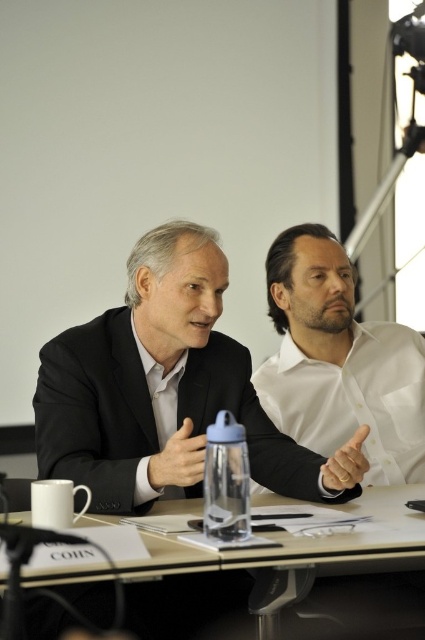
Question: Does white glossy shirt at center have a greater width compared to clear glass water at center?

Choices:
 (A) yes
 (B) no

Answer: (B)

Question: Based on their relative distances, which object is farther from the black matte suit at center?

Choices:
 (A) clear glass water at center
 (B) white glossy shirt at center

Answer: (B)

Question: Which of these objects is positioned farthest from the white glossy shirt at center?

Choices:
 (A) clear glass water at center
 (B) black matte suit at center

Answer: (A)

Question: Can you confirm if black matte suit at center is thinner than clear glass water at center?

Choices:
 (A) yes
 (B) no

Answer: (A)

Question: Which point appears closest to the camera in this image?

Choices:
 (A) (221, 573)
 (B) (295, 444)

Answer: (A)

Question: Does white glossy shirt at center come in front of clear glass water at center?

Choices:
 (A) no
 (B) yes

Answer: (A)